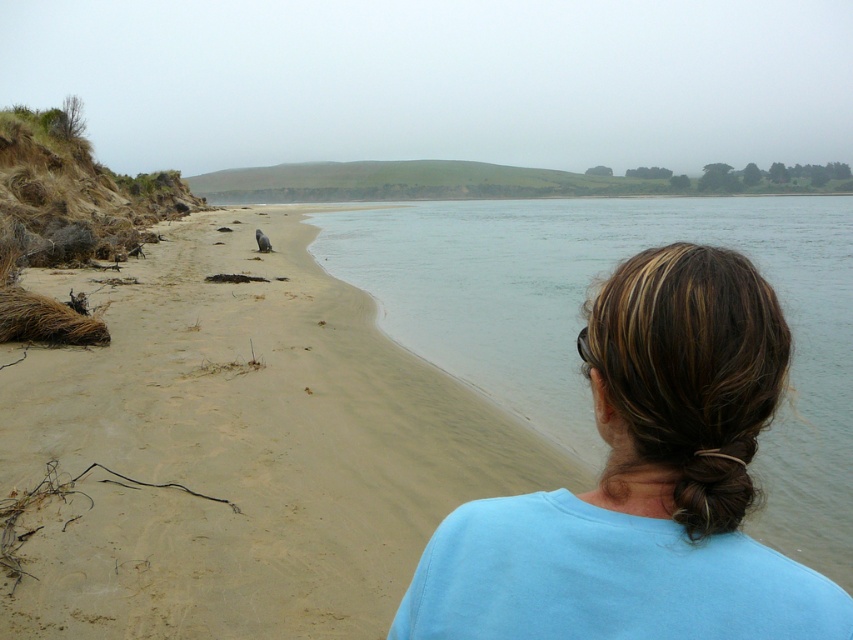
Is sandy beach at lower left in front of blue fabric hair at center?

No, it is not.

What do you see at coordinates (236, 449) in the screenshot? I see `sandy beach at lower left` at bounding box center [236, 449].

Who is more distant from viewer, (386, 408) or (611, 403)?

The point (386, 408) is behind.

This screenshot has height=640, width=853. I want to click on sandy beach at lower left, so click(x=236, y=449).